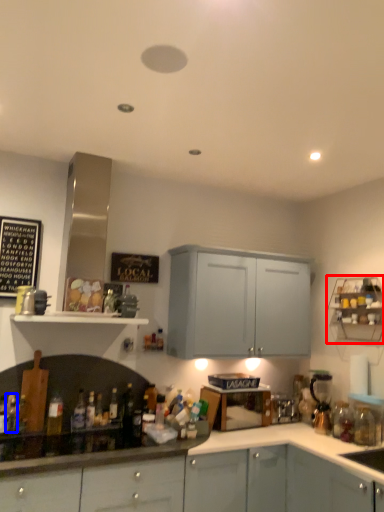
Question: Among these objects, which one is nearest to the camera, shelf (highlighted by a red box) or bottle (highlighted by a blue box)?

Choices:
 (A) shelf
 (B) bottle

Answer: (B)